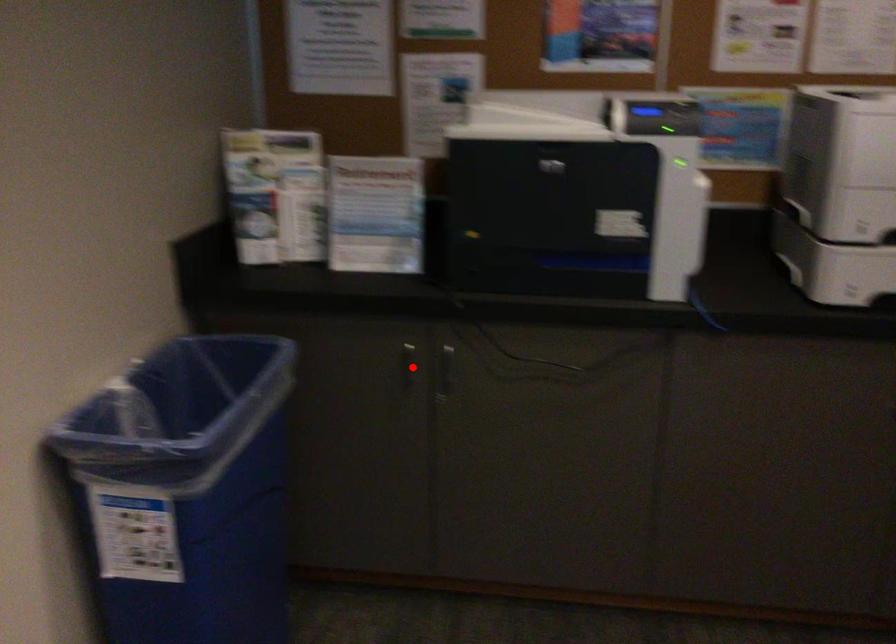
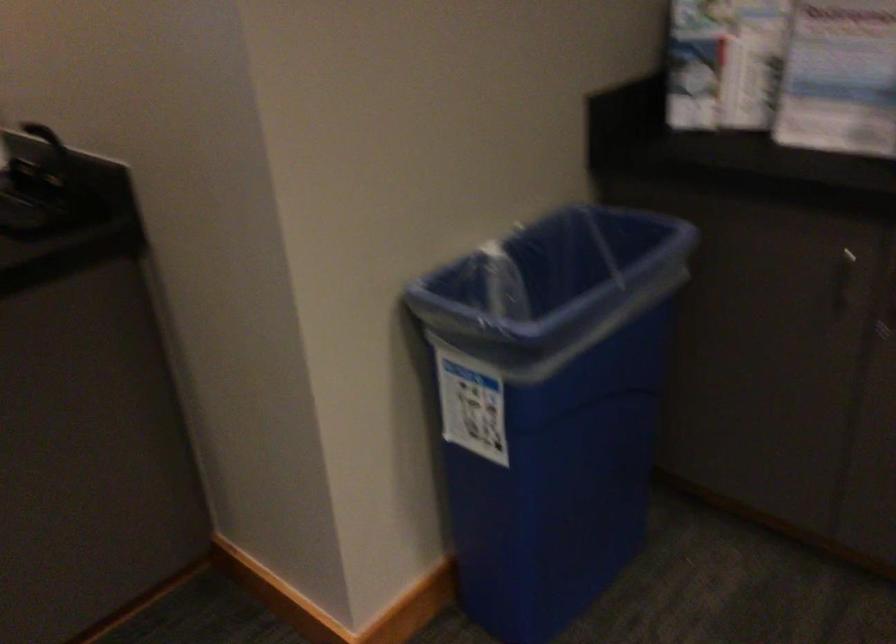
Question: I am providing you with two images of the same scene from different viewpoints. A red point is shown in image1. For the corresponding object point in image2, is it positioned nearer or farther from the camera?

Choices:
 (A) Nearer
 (B) Farther

Answer: (A)